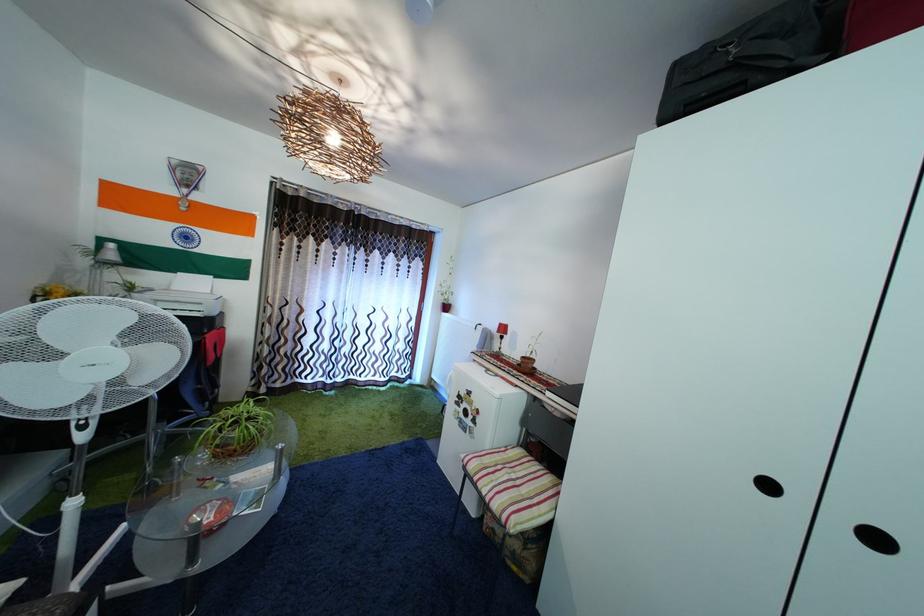
Find where to lift the small red lamp. Please return your answer as a coordinate pair (x, y).

(501, 334)